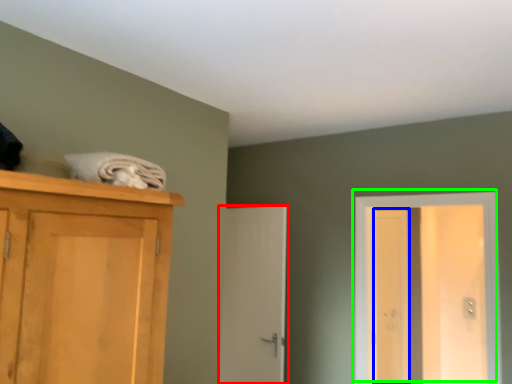
Question: Which is farther away from door (highlighted by a red box)? screen door (highlighted by a blue box) or door (highlighted by a green box)?

Choices:
 (A) screen door
 (B) door

Answer: (A)